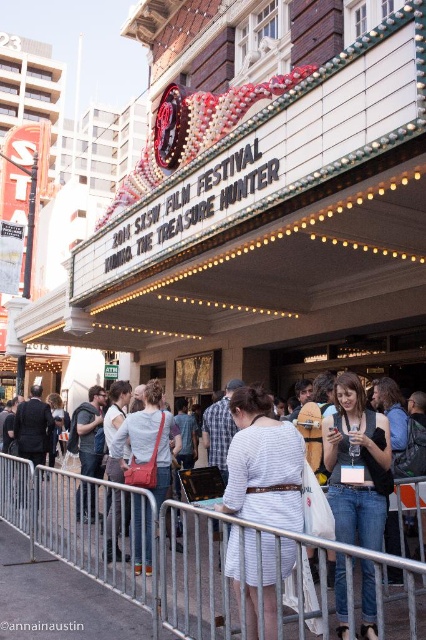
You are standing at the entrance of the theater and want to place a small decoration. You have two points marked on the floor as reference points. The first point is at coordinates point (218, 632) and the second point is at point (167, 440). Which point is closer to the entrance of the theater?

Point (218, 632) is in front of point (167, 440), so the first point is closer to the entrance of the theater.

You are a photographer standing at the entrance of the theater. You want to take a photo of the white striped dress at center and the light blue denim jeans at center so that both are in the frame. The camera you are using has a maximum focus range of 7 meters. Will both subjects be within the focus range?

The white striped dress at center and light blue denim jeans at center are 7.29 meters apart from each other. Since the camera can only focus up to 7 meters, the distance between them exceeds the focus range. Therefore, both subjects cannot be in focus simultaneously.